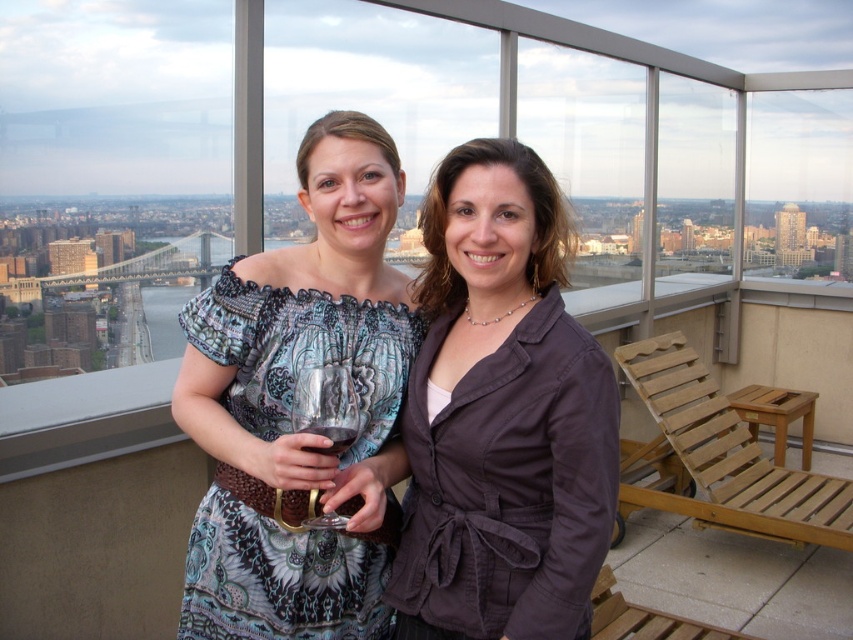
Question: Does transparent glass at center have a smaller size compared to translucent glass at center?

Choices:
 (A) yes
 (B) no

Answer: (B)

Question: Which of the following is the closest to the observer?

Choices:
 (A) patterned fabric dress at center
 (B) translucent glass at center

Answer: (A)

Question: Which point is farther to the camera?

Choices:
 (A) (325, 429)
 (B) (544, 316)

Answer: (A)

Question: Based on their relative distances, which object is farther from the matte brown blazer at center?

Choices:
 (A) patterned fabric dress at center
 (B) transparent glass at center

Answer: (B)

Question: Does matte brown blazer at center have a larger size compared to transparent glass at center?

Choices:
 (A) yes
 (B) no

Answer: (A)

Question: Can you confirm if patterned fabric dress at center is positioned above transparent glass at center?

Choices:
 (A) yes
 (B) no

Answer: (A)